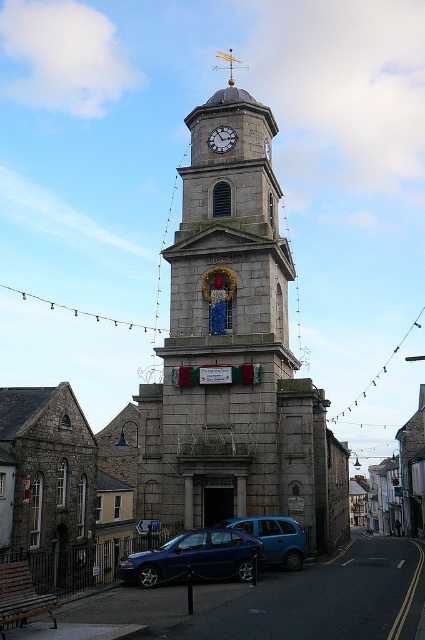
Question: Does blue matte van at center have a smaller size compared to white stone clock at center?

Choices:
 (A) no
 (B) yes

Answer: (B)

Question: Is stone clock tower at center to the left of blue matte van at center from the viewer's perspective?

Choices:
 (A) no
 (B) yes

Answer: (B)

Question: Which point appears closest to the camera in this image?

Choices:
 (A) (258, 532)
 (B) (235, 138)
 (C) (249, 573)
 (D) (252, 204)

Answer: (C)

Question: Which point appears farthest from the camera in this image?

Choices:
 (A) (224, 145)
 (B) (243, 577)

Answer: (A)

Question: Which point appears closest to the camera in this image?

Choices:
 (A) (252, 237)
 (B) (215, 140)
 (C) (280, 525)

Answer: (C)

Question: Considering the relative positions of stone clock tower at center and metallic blue sedan at center in the image provided, where is stone clock tower at center located with respect to metallic blue sedan at center?

Choices:
 (A) left
 (B) right

Answer: (B)